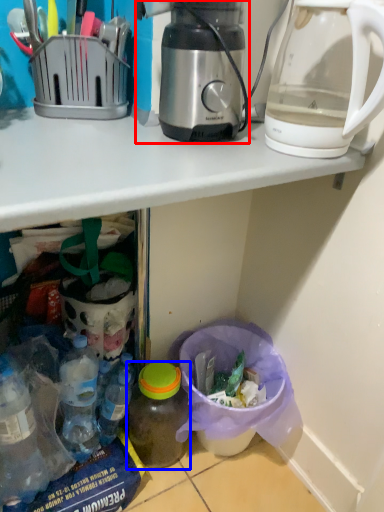
Question: Which object appears closest to the camera in this image, coffee maker (highlighted by a red box) or bottle (highlighted by a blue box)?

Choices:
 (A) coffee maker
 (B) bottle

Answer: (A)